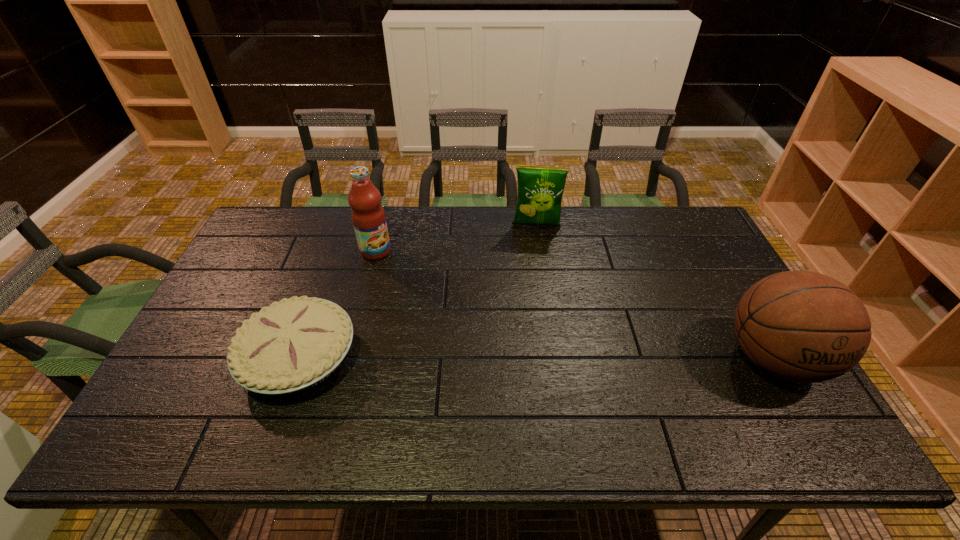
Where is `vacant space located 0.100m on the front-facing side of the crisp (potato chip)`? vacant space located 0.100m on the front-facing side of the crisp (potato chip) is located at coordinates (534, 251).

Locate an element on the screen. free space located 0.400m on the front-facing side of the crisp (potato chip) is located at coordinates (533, 321).

Locate an element on the screen. The width and height of the screenshot is (960, 540). fruit juice that is at the far edge is located at coordinates (368, 216).

Where is `crisp (potato chip) that is positioned at the far edge`? Image resolution: width=960 pixels, height=540 pixels. crisp (potato chip) that is positioned at the far edge is located at coordinates (540, 188).

You are a GUI agent. You are given a task and a screenshot of the screen. Output one action in this format:
    pyautogui.click(x=<x>, y=<y>)
    Task: Click on the pie located at the near edge
    The height and width of the screenshot is (540, 960).
    Given the screenshot: What is the action you would take?
    pyautogui.click(x=294, y=344)

Locate an element on the screen. This screenshot has height=540, width=960. basketball that is at the near edge is located at coordinates (801, 326).

Find the location of a particular element. This screenshot has height=540, width=960. object that is positioned at the left edge is located at coordinates (294, 344).

Find the location of a particular element. Image resolution: width=960 pixels, height=540 pixels. object situated at the right edge is located at coordinates (801, 326).

Where is `object at the near left corner`? Image resolution: width=960 pixels, height=540 pixels. object at the near left corner is located at coordinates (294, 344).

At what (x,y) coordinates should I click in order to perform the action: click on object that is at the near right corner. Please return your answer as a coordinate pair (x, y). The width and height of the screenshot is (960, 540). Looking at the image, I should click on (801, 326).